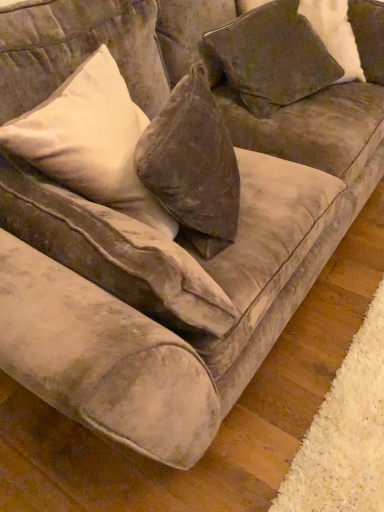
Question: Should I look upward or downward to see velvet beige pillow at upper left, acting as the second pillow starting from the right?

Choices:
 (A) down
 (B) up

Answer: (B)

Question: Is velvet beige pillow at upper left, acting as the first pillow starting from the left, oriented towards velvet brown pillow at upper right, placed as the 1th pillow when sorted from right to left?

Choices:
 (A) yes
 (B) no

Answer: (B)

Question: Is velvet brown pillow at upper right, placed as the 1th pillow when sorted from right to left, located within velvet beige pillow at upper left, acting as the second pillow starting from the right?

Choices:
 (A) no
 (B) yes

Answer: (A)

Question: Is velvet beige pillow at upper left, acting as the second pillow starting from the right, far from velvet brown pillow at upper right, placed as the 1th pillow when sorted from right to left?

Choices:
 (A) no
 (B) yes

Answer: (A)

Question: From a real-world perspective, is velvet beige pillow at upper left, acting as the first pillow starting from the left, physically below velvet brown pillow at upper right, arranged as the second pillow when viewed from the left?

Choices:
 (A) yes
 (B) no

Answer: (B)

Question: Considering the relative sizes of velvet beige pillow at upper left, acting as the second pillow starting from the right, and velvet brown pillow at upper right, placed as the 1th pillow when sorted from right to left, in the image provided, is velvet beige pillow at upper left, acting as the second pillow starting from the right, shorter than velvet brown pillow at upper right, placed as the 1th pillow when sorted from right to left,?

Choices:
 (A) no
 (B) yes

Answer: (A)

Question: From the image's perspective, is velvet beige pillow at upper left, acting as the second pillow starting from the right, under velvet brown pillow at upper right, placed as the 1th pillow when sorted from right to left?

Choices:
 (A) yes
 (B) no

Answer: (A)

Question: Is velvet brown pillow at upper right, arranged as the second pillow when viewed from the left, aimed at velvet beige pillow at upper left, acting as the second pillow starting from the right?

Choices:
 (A) no
 (B) yes

Answer: (A)

Question: From a real-world perspective, is velvet brown pillow at upper right, placed as the 1th pillow when sorted from right to left, on velvet beige pillow at upper left, acting as the second pillow starting from the right?

Choices:
 (A) yes
 (B) no

Answer: (B)

Question: Is velvet brown pillow at upper right, placed as the 1th pillow when sorted from right to left, positioned in front of velvet beige pillow at upper left, acting as the second pillow starting from the right?

Choices:
 (A) no
 (B) yes

Answer: (A)

Question: Can you confirm if velvet brown pillow at upper right, arranged as the second pillow when viewed from the left, is bigger than velvet beige pillow at upper left, acting as the second pillow starting from the right?

Choices:
 (A) no
 (B) yes

Answer: (A)

Question: Is velvet brown pillow at upper right, arranged as the second pillow when viewed from the left, far away from velvet beige pillow at upper left, acting as the second pillow starting from the right?

Choices:
 (A) no
 (B) yes

Answer: (A)

Question: Considering the relative positions of velvet brown pillow at upper right, arranged as the second pillow when viewed from the left, and velvet beige pillow at upper left, acting as the second pillow starting from the right, in the image provided, is velvet brown pillow at upper right, arranged as the second pillow when viewed from the left, to the right of velvet beige pillow at upper left, acting as the second pillow starting from the right, from the viewer's perspective?

Choices:
 (A) yes
 (B) no

Answer: (A)

Question: From a real-world perspective, is velvet beige pillow at upper left, acting as the first pillow starting from the left, positioned above or below velvet brown pillow at upper right, arranged as the second pillow when viewed from the left?

Choices:
 (A) below
 (B) above

Answer: (B)